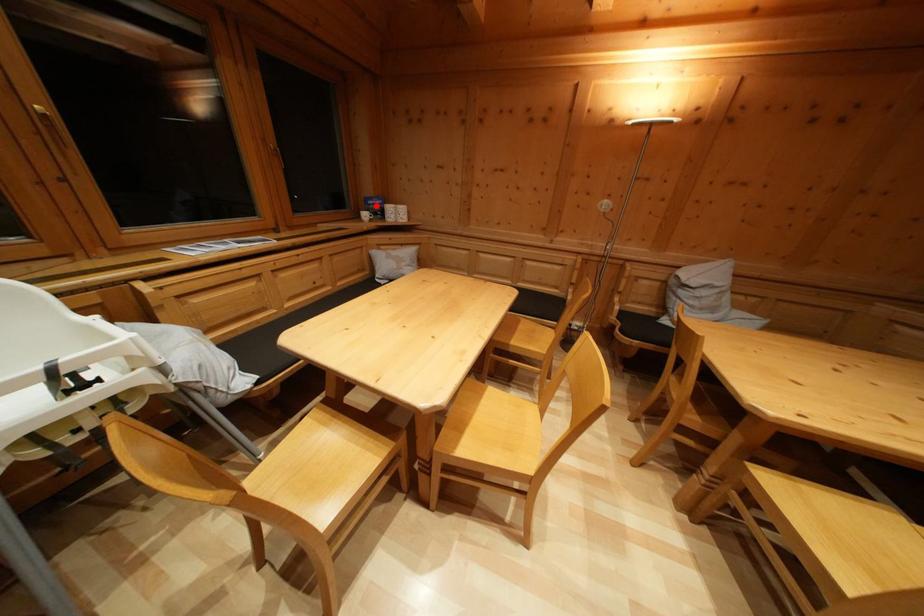
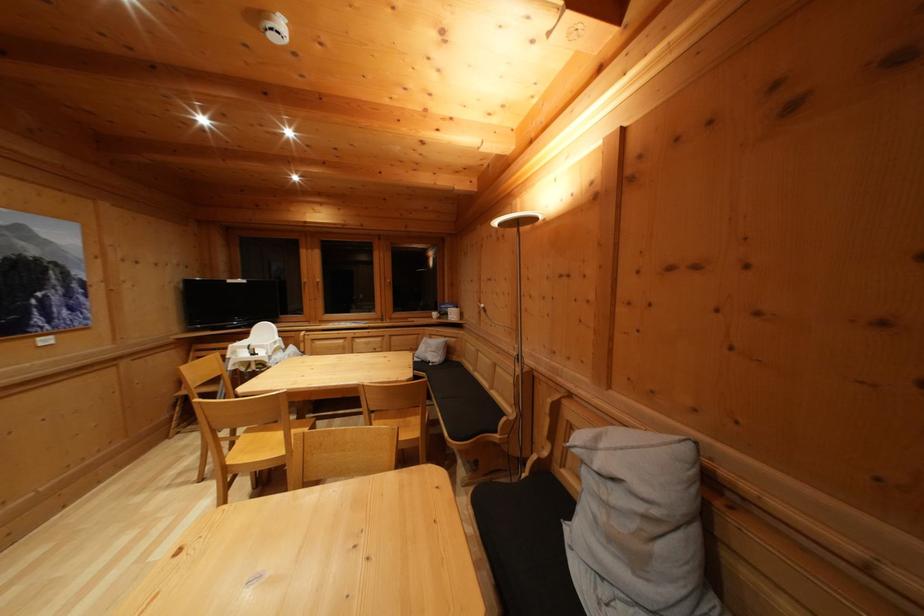
Locate, in the second image, the point that corresponds to the highlighted location in the first image.

(450, 310)